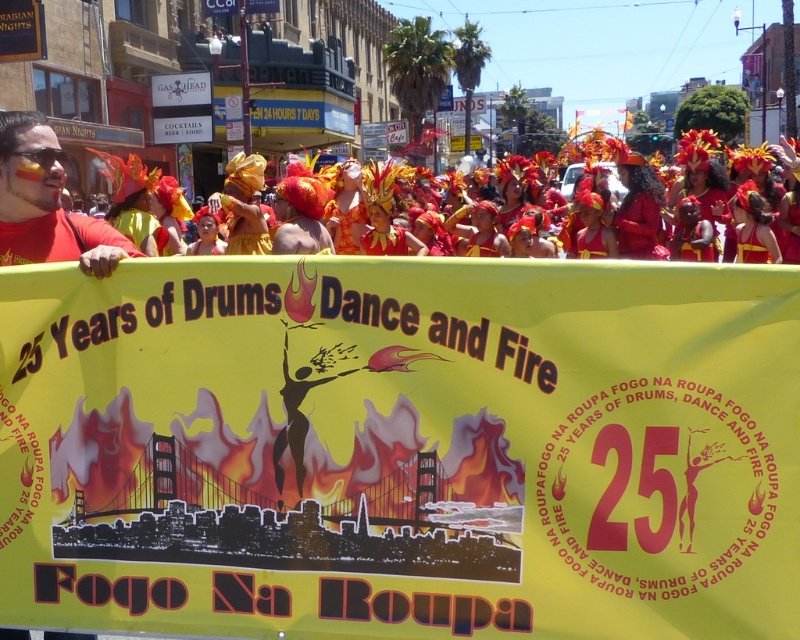
You are a photographer trying to capture both the yellow paper banner at center and the shiny gold headpiece at upper right in a single frame. Based on their sizes, which object should you focus on first to ensure both are in the frame?

The yellow paper banner at center is taller than the shiny gold headpiece at upper right, so you should focus on the yellow paper banner at center first to ensure both fit in the frame.

You are a photographer at the parade and want to capture both the matte red shirt at lower left and the shiny metallic headdress at center in a single shot. Which object should you frame first to ensure both are visible?

The matte red shirt at lower left should be framed first since it is positioned to the left of the shiny metallic headdress at center, allowing the photographer to include both in the shot by starting from the left side.